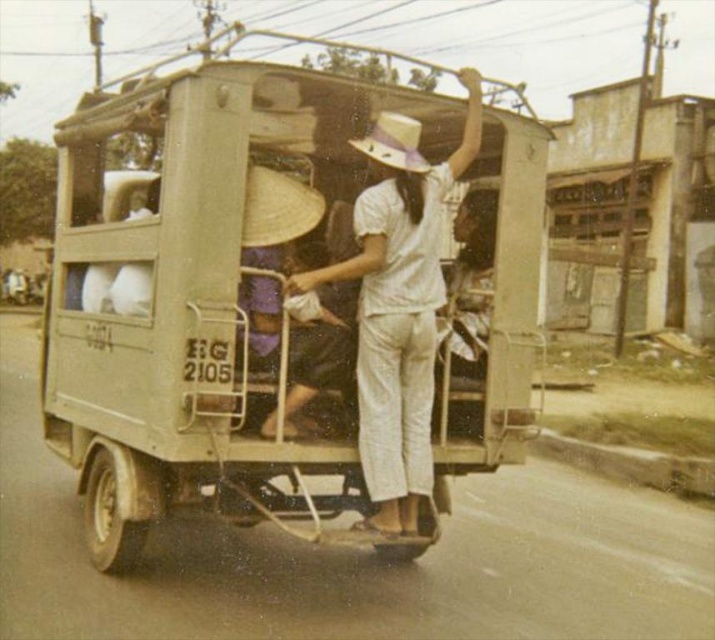
You are a photographer standing near the xe om vehicle and want to take a photo of both the natural straw hat at center and the white straw hat at center. Which hat should you focus on if you want to capture the larger one in your shot?

The natural straw hat at center has a larger size compared to the white straw hat at center, so you should focus on the natural straw hat at center to capture the larger one in your shot.

You are a passenger in the matte beige truck at center and want to reach the white straw hat at center. Which direction should you move to get closer to the hat?

The matte beige truck at center is above the white straw hat at center, so you should move downward to get closer to the hat.